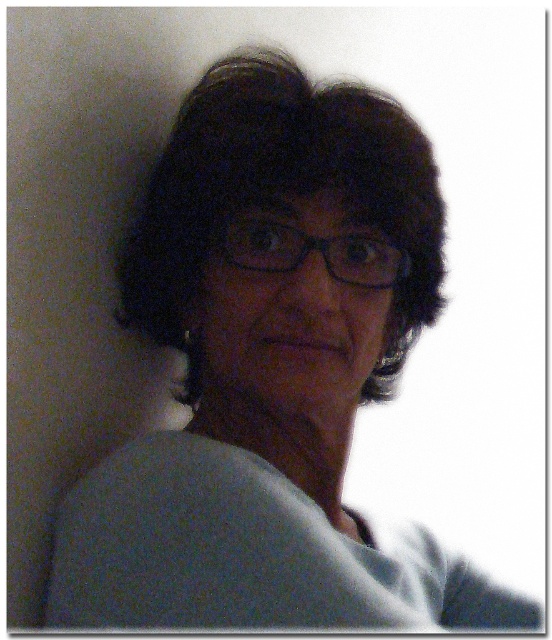
Question: Does dark curly hair at center appear over black plastic glasses at center?

Choices:
 (A) yes
 (B) no

Answer: (A)

Question: Can you confirm if dark curly hair at center is smaller than black plastic glasses at center?

Choices:
 (A) yes
 (B) no

Answer: (B)

Question: Which point appears closest to the camera in this image?

Choices:
 (A) (358, 257)
 (B) (199, 118)

Answer: (B)

Question: Is dark curly hair at center further to the viewer compared to black plastic glasses at center?

Choices:
 (A) no
 (B) yes

Answer: (A)

Question: Which object is closer to the camera taking this photo?

Choices:
 (A) black plastic glasses at center
 (B) dark curly hair at center

Answer: (B)